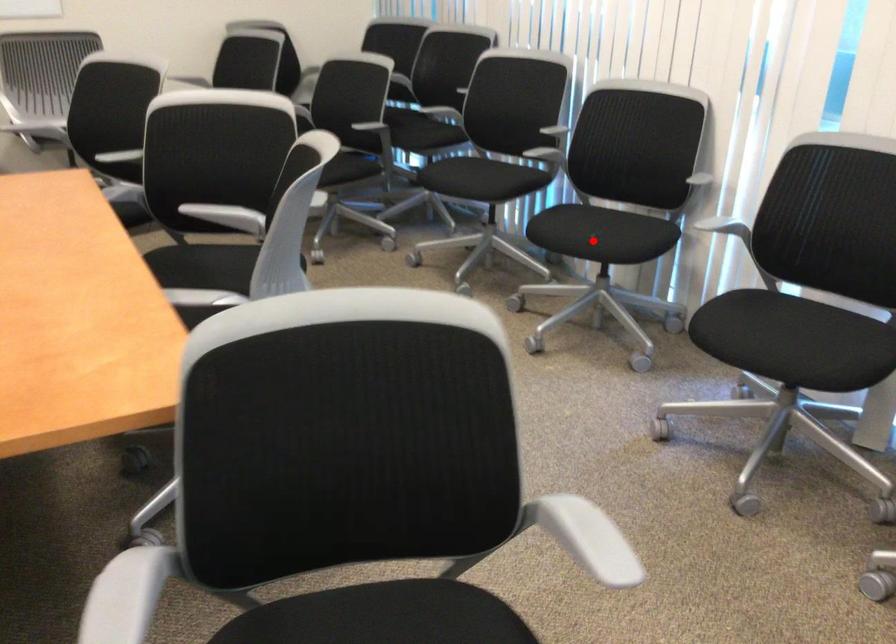
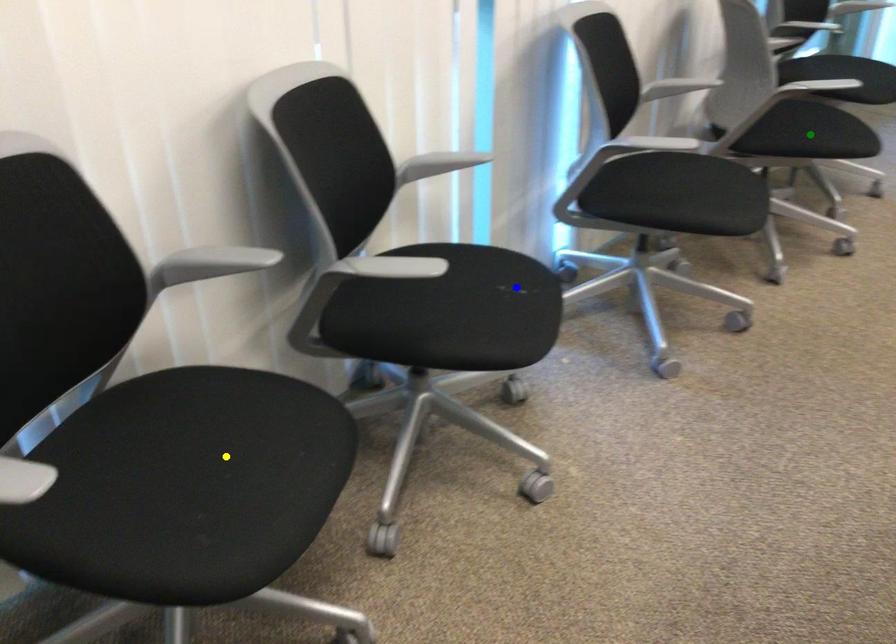
Question: I am providing you with two images of the same scene from different viewpoints. A red point is marked on the first image. You are given multiple points on the second image. Can you choose the point in image 2 that corresponds to the point in image 1?

Choices:
 (A) blue point
 (B) yellow point
 (C) green point

Answer: (A)